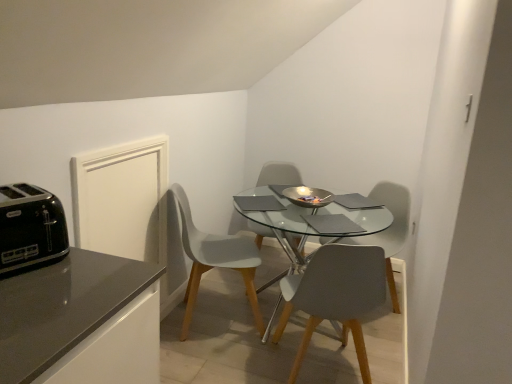
Question: From the image's perspective, is matte gray chair at center, which is counted as the 4th chair, starting from the left, located beneath transparent glass table at center?

Choices:
 (A) no
 (B) yes

Answer: (A)

Question: From a real-world perspective, is matte gray chair at center, which is counted as the 4th chair, starting from the left, positioned under transparent glass table at center based on gravity?

Choices:
 (A) no
 (B) yes

Answer: (A)

Question: Does matte gray chair at center, which is counted as the 4th chair, starting from the left, have a lesser width compared to transparent glass table at center?

Choices:
 (A) no
 (B) yes

Answer: (B)

Question: Does matte gray chair at center, which is counted as the first chair, starting from the right, have a lesser height compared to transparent glass table at center?

Choices:
 (A) no
 (B) yes

Answer: (A)

Question: Is matte gray chair at center, which is counted as the 4th chair, starting from the left, in front of transparent glass table at center?

Choices:
 (A) yes
 (B) no

Answer: (B)

Question: Based on their positions, is black plastic toaster at left located to the left or right of matte gray chair at center, which is counted as the first chair, starting from the right?

Choices:
 (A) right
 (B) left

Answer: (B)

Question: Looking at the image, does black plastic toaster at left seem bigger or smaller compared to matte gray chair at center, which is counted as the 4th chair, starting from the left?

Choices:
 (A) big
 (B) small

Answer: (B)

Question: Is black plastic toaster at left in front of or behind matte gray chair at center, which is counted as the first chair, starting from the right, in the image?

Choices:
 (A) behind
 (B) front

Answer: (B)

Question: From a real-world perspective, relative to matte gray chair at center, which is counted as the 4th chair, starting from the left, is black plastic toaster at left vertically above or below?

Choices:
 (A) below
 (B) above

Answer: (B)

Question: Would you say matte gray chair at center, positioned as the 2th chair in left-to-right order, is to the left or to the right of white matte chair at center, positioned as the fourth chair in right-to-left order, in the picture?

Choices:
 (A) right
 (B) left

Answer: (A)

Question: Is point (283, 165) positioned closer to the camera than point (208, 248)?

Choices:
 (A) farther
 (B) closer

Answer: (A)

Question: From a real-world perspective, is matte gray chair at center, positioned as the 2th chair in left-to-right order, above or below white matte chair at center, the first chair from the left?

Choices:
 (A) above
 (B) below

Answer: (A)

Question: From the image's perspective, is matte gray chair at center, marked as the third chair in a right-to-left arrangement, located above or below white matte chair at center, the first chair from the left?

Choices:
 (A) above
 (B) below

Answer: (A)

Question: From the image's perspective, is transparent glass table at center positioned above or below black plastic toaster at left?

Choices:
 (A) below
 (B) above

Answer: (A)

Question: Would you say transparent glass table at center is inside or outside black plastic toaster at left?

Choices:
 (A) outside
 (B) inside

Answer: (A)